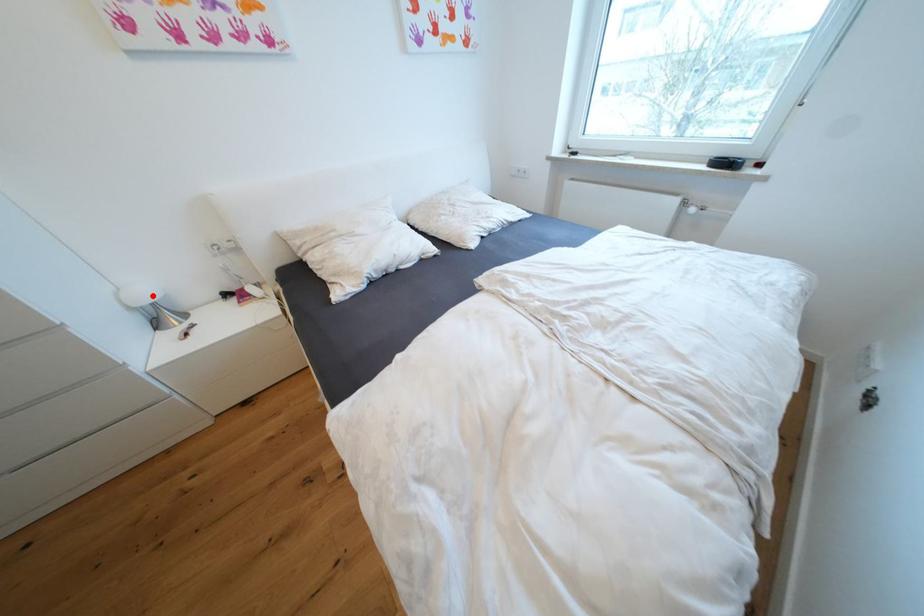
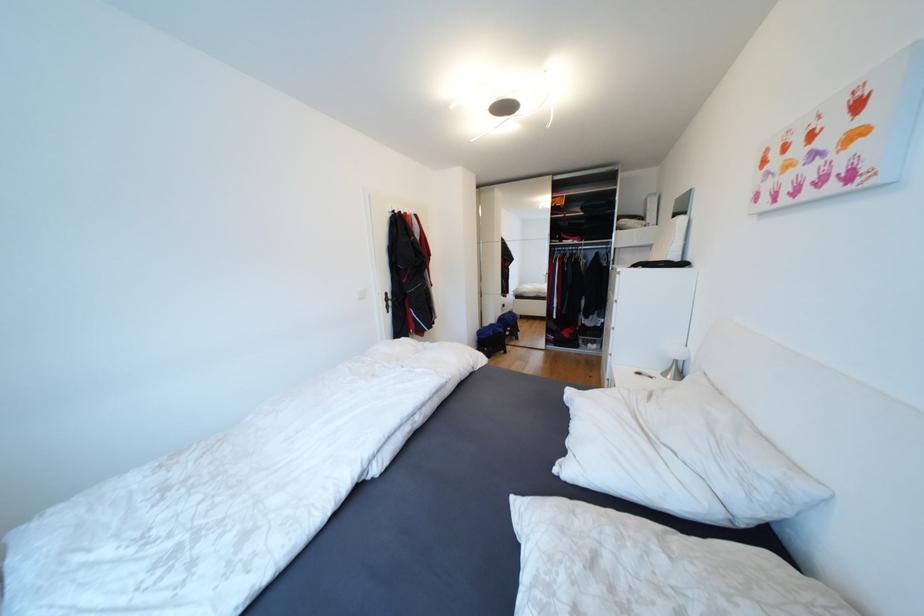
Where in the second image is the point corresponding to the highlighted location from the first image?

(682, 354)